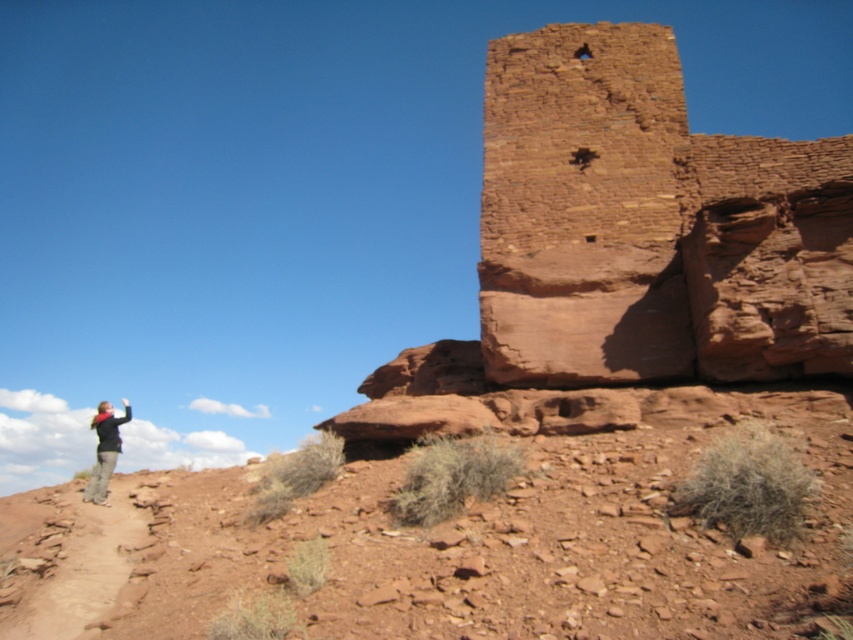
You are standing at the base of the ancient stone structure in the desert. You notice two points marked in the scene. The first point is at coordinates point (601, 324) and the second is at point (109, 458). Which point is closer to you?

Point (109, 458) is closer to you because point (601, 324) is behind it.